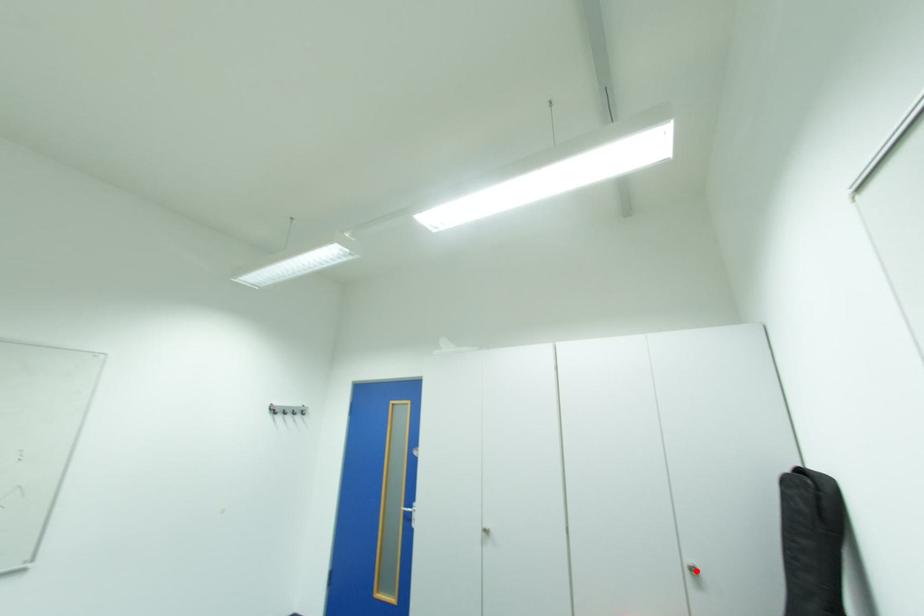
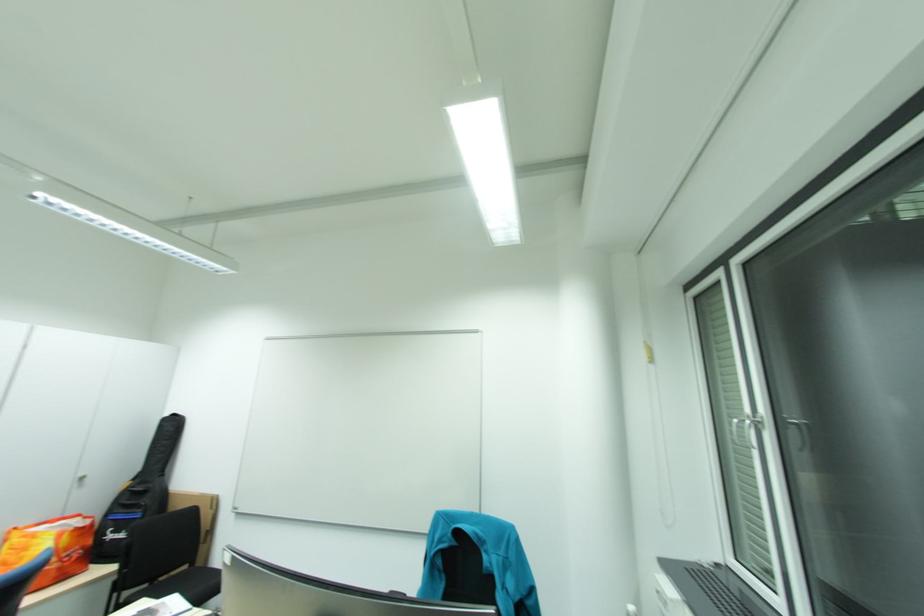
Locate, in the second image, the point that corresponds to the highlighted location in the first image.

(86, 480)